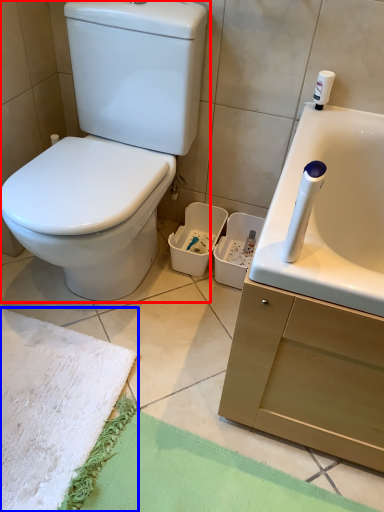
Question: Among these objects, which one is nearest to the camera, toilet (highlighted by a red box) or beach towel (highlighted by a blue box)?

Choices:
 (A) toilet
 (B) beach towel

Answer: (A)